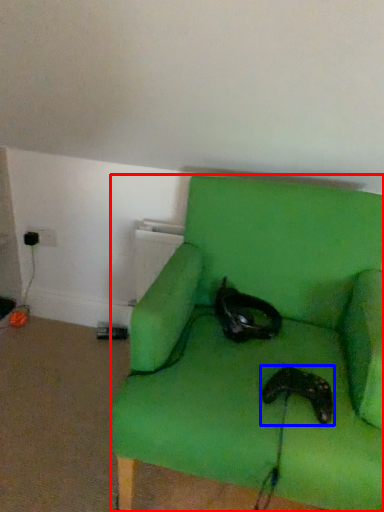
Question: Among these objects, which one is nearest to the camera, chair (highlighted by a red box) or footwear (highlighted by a blue box)?

Choices:
 (A) chair
 (B) footwear

Answer: (A)